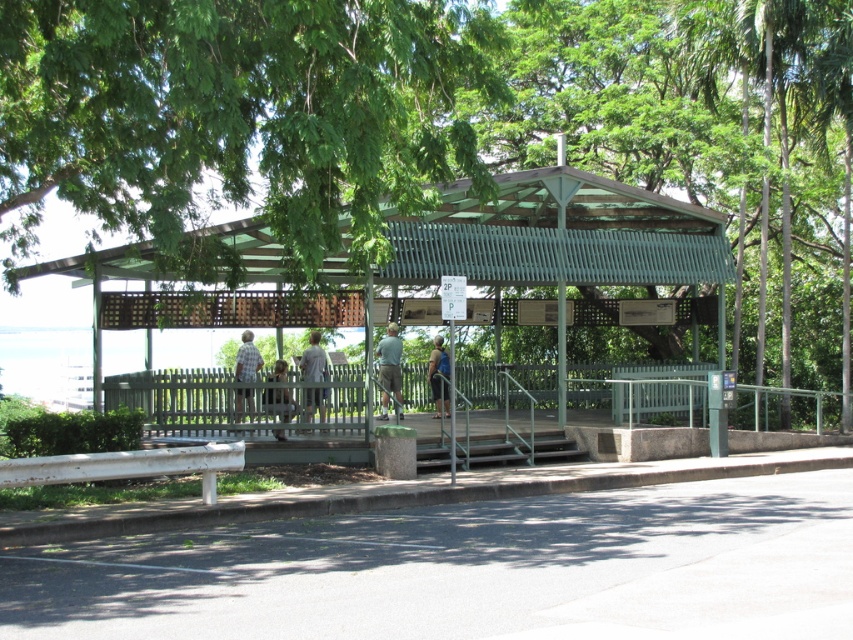
Question: Based on their relative distances, which object is farther from the green fabric shirt at center?

Choices:
 (A) light brown wooden fence at center
 (B) green fabric backpack at center

Answer: (A)

Question: Which object appears closest to the camera in this image?

Choices:
 (A) green fabric backpack at center
 (B) green fabric shirt at center

Answer: (B)

Question: Can you confirm if green leafy tree at upper center is thinner than plaid shirt at center?

Choices:
 (A) no
 (B) yes

Answer: (A)

Question: Is green leafy tree at upper center above green fabric shirt at center?

Choices:
 (A) no
 (B) yes

Answer: (B)

Question: Does green fabric shirt at center appear under light brown wooden fence at center?

Choices:
 (A) no
 (B) yes

Answer: (A)

Question: Which point is farther to the camera?

Choices:
 (A) plaid shirt at center
 (B) green fabric backpack at center

Answer: (B)